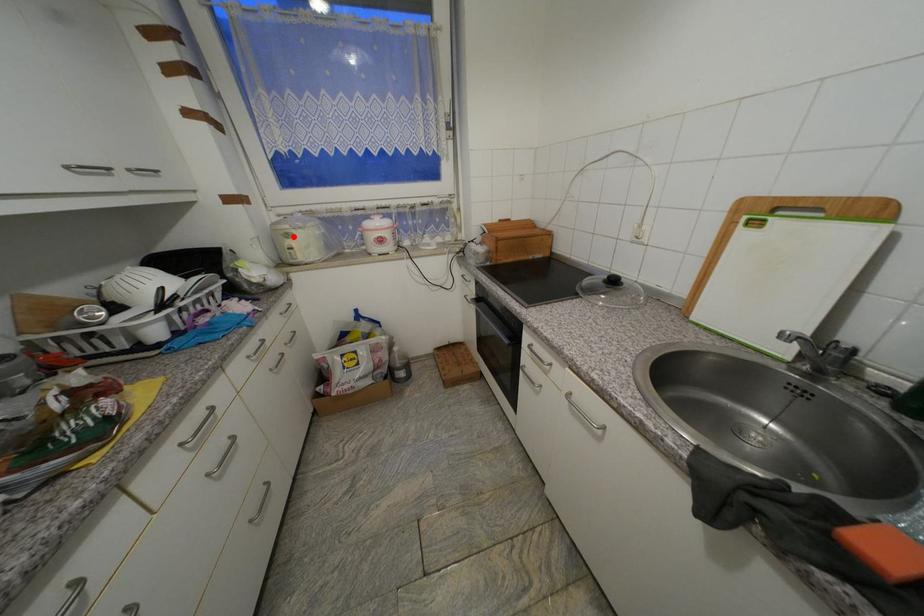
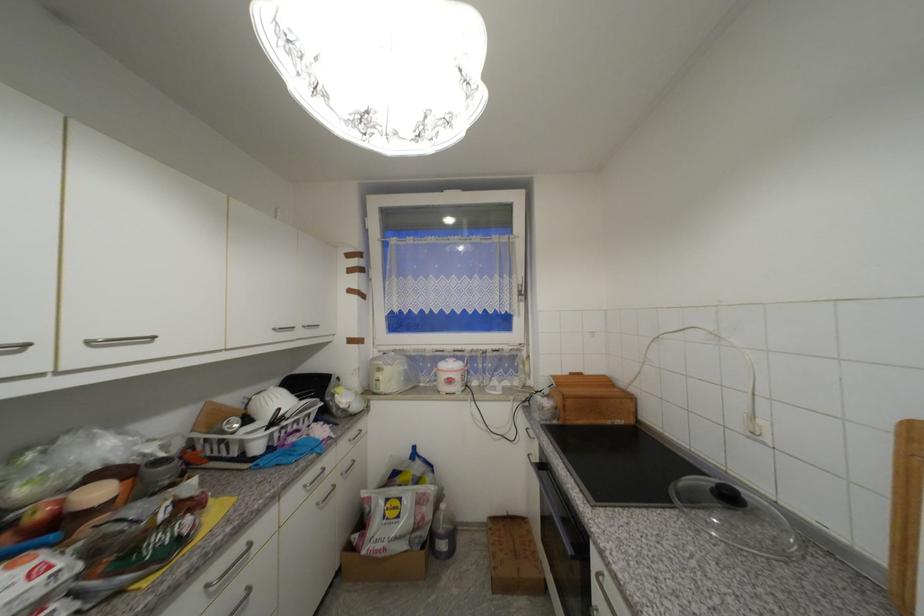
Question: I am providing you with two images of the same scene from different viewpoints. A red point is shown in image1. For the corresponding object point in image2, is it positioned nearer or farther from the camera?

Choices:
 (A) Nearer
 (B) Farther

Answer: (B)